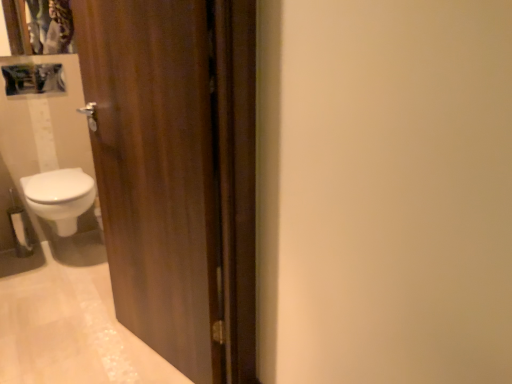
Question: Based on their sizes in the image, would you say matte plastic medicine cabinet at upper left is bigger or smaller than white glossy bidet at lower left?

Choices:
 (A) big
 (B) small

Answer: (B)

Question: Considering the positions of matte plastic medicine cabinet at upper left and white glossy bidet at lower left in the image, is matte plastic medicine cabinet at upper left wider or thinner than white glossy bidet at lower left?

Choices:
 (A) thin
 (B) wide

Answer: (A)

Question: Which is farther from the white glossy bidet at lower left?

Choices:
 (A) wooden door at left
 (B) white matte toilet paper at lower left
 (C) matte plastic medicine cabinet at upper left

Answer: (A)

Question: Which object is the closest to the white glossy bidet at lower left?

Choices:
 (A) matte plastic medicine cabinet at upper left
 (B) wooden door at left
 (C) white matte toilet paper at lower left

Answer: (C)